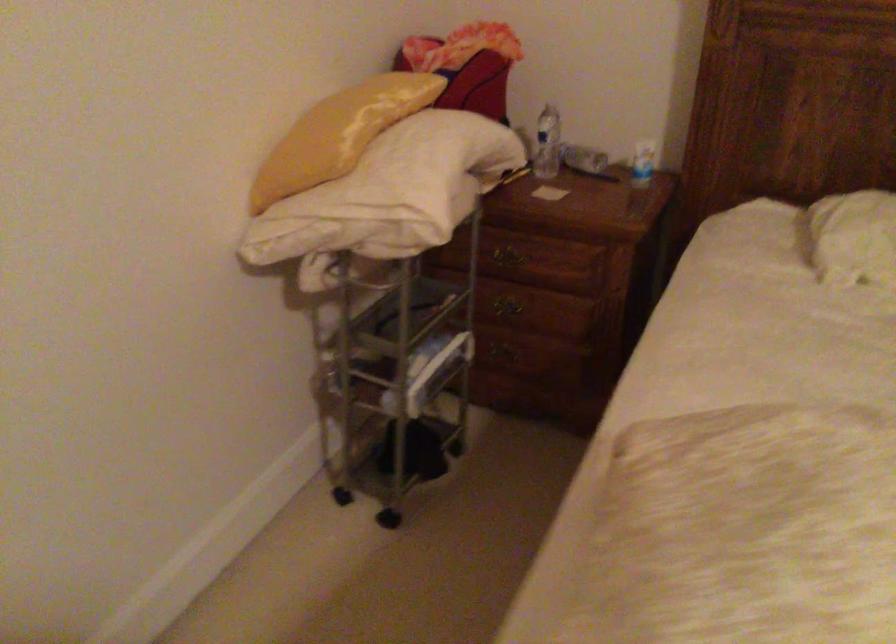
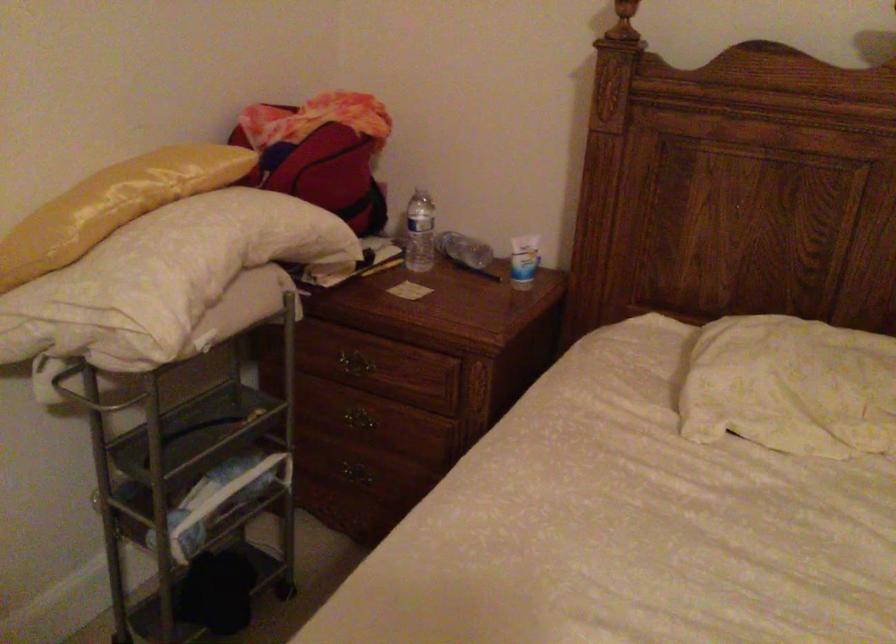
The point at (366, 281) is marked in the first image. Where is the corresponding point in the second image?

(91, 393)